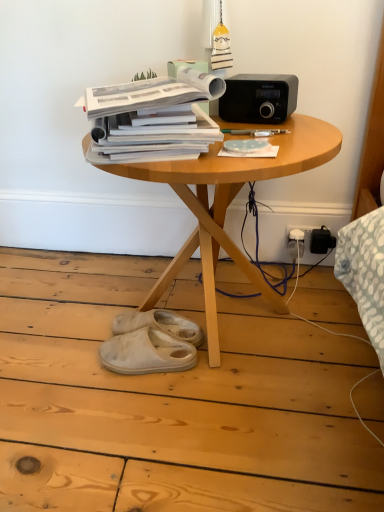
Question: Does white suede slippers at lower center, which is the 1th footwear in front-to-back order, have a greater width compared to wooden table at center?

Choices:
 (A) yes
 (B) no

Answer: (B)

Question: Is the depth of white suede slippers at lower center, which is the 1th footwear in front-to-back order, greater than that of wooden table at center?

Choices:
 (A) no
 (B) yes

Answer: (B)

Question: Does white suede slippers at lower center, which is the second footwear in back-to-front order, have a lesser width compared to wooden table at center?

Choices:
 (A) yes
 (B) no

Answer: (A)

Question: Considering the relative positions of white suede slippers at lower center, which is the 1th footwear in front-to-back order, and wooden table at center in the image provided, is white suede slippers at lower center, which is the 1th footwear in front-to-back order, to the right of wooden table at center from the viewer's perspective?

Choices:
 (A) no
 (B) yes

Answer: (A)

Question: Can you confirm if white suede slippers at lower center, which is the second footwear in back-to-front order, is smaller than wooden table at center?

Choices:
 (A) yes
 (B) no

Answer: (A)

Question: Can you confirm if white suede slippers at lower center, which is the 1th footwear in front-to-back order, is positioned to the left of wooden table at center?

Choices:
 (A) yes
 (B) no

Answer: (A)

Question: Is white suede slippers at lower center, marked as the second footwear in a front-to-back arrangement, further to the viewer compared to blue dotted paper at center, positioned as the first paperback book in right-to-left order?

Choices:
 (A) no
 (B) yes

Answer: (B)

Question: Is white suede slippers at lower center, positioned as the first footwear in back-to-front order, facing towards blue dotted paper at center, positioned as the first paperback book in right-to-left order?

Choices:
 (A) no
 (B) yes

Answer: (A)

Question: Can you confirm if white suede slippers at lower center, positioned as the first footwear in back-to-front order, is positioned to the right of blue dotted paper at center, positioned as the first paperback book in right-to-left order?

Choices:
 (A) no
 (B) yes

Answer: (A)

Question: Is white suede slippers at lower center, positioned as the first footwear in back-to-front order, not close to blue dotted paper at center, which ranks as the second paperback book in left-to-right order?

Choices:
 (A) yes
 (B) no

Answer: (B)

Question: Can you confirm if white suede slippers at lower center, positioned as the first footwear in back-to-front order, is taller than blue dotted paper at center, positioned as the first paperback book in right-to-left order?

Choices:
 (A) yes
 (B) no

Answer: (A)

Question: From the image's perspective, is white suede slippers at lower center, marked as the second footwear in a front-to-back arrangement, above blue dotted paper at center, which ranks as the second paperback book in left-to-right order?

Choices:
 (A) yes
 (B) no

Answer: (B)

Question: Does white suede slippers at lower center, positioned as the first footwear in back-to-front order, have a greater width compared to wooden table at center?

Choices:
 (A) yes
 (B) no

Answer: (B)